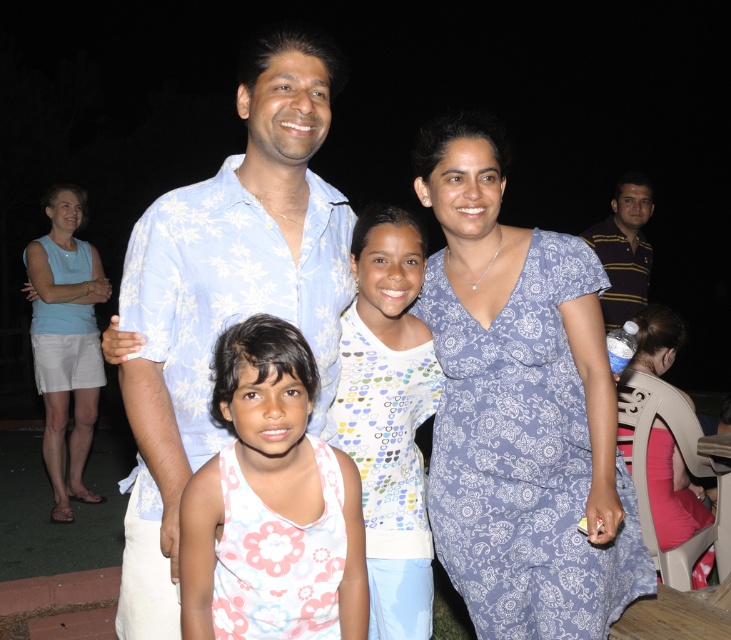
The width and height of the screenshot is (731, 640). Find the location of `light blue floral shirt at center`. light blue floral shirt at center is located at coordinates (227, 296).

Who is positioned more to the left, light blue floral shirt at center or striped polo shirt at right?

light blue floral shirt at center

Image resolution: width=731 pixels, height=640 pixels. Describe the element at coordinates (227, 296) in the screenshot. I see `light blue floral shirt at center` at that location.

What are the coordinates of `light blue floral shirt at center` in the screenshot? It's located at (227, 296).

Is blue paisley dress at center closer to the viewer compared to light blue floral shirt at center?

No, blue paisley dress at center is further to the viewer.

Between blue paisley dress at center and light blue floral shirt at center, which one appears on the left side from the viewer's perspective?

Positioned to the left is light blue floral shirt at center.

Where is `blue paisley dress at center`? blue paisley dress at center is located at coordinates (520, 406).

Is light blue fabric skirt at lower left positioned before striped polo shirt at right?

No, it is behind striped polo shirt at right.

Does light blue fabric skirt at lower left have a greater width compared to striped polo shirt at right?

No.

Does point (75, 353) lie in front of point (645, 212)?

Yes, point (75, 353) is closer to viewer.

Locate an element on the screen. This screenshot has height=640, width=731. light blue fabric skirt at lower left is located at coordinates (67, 340).